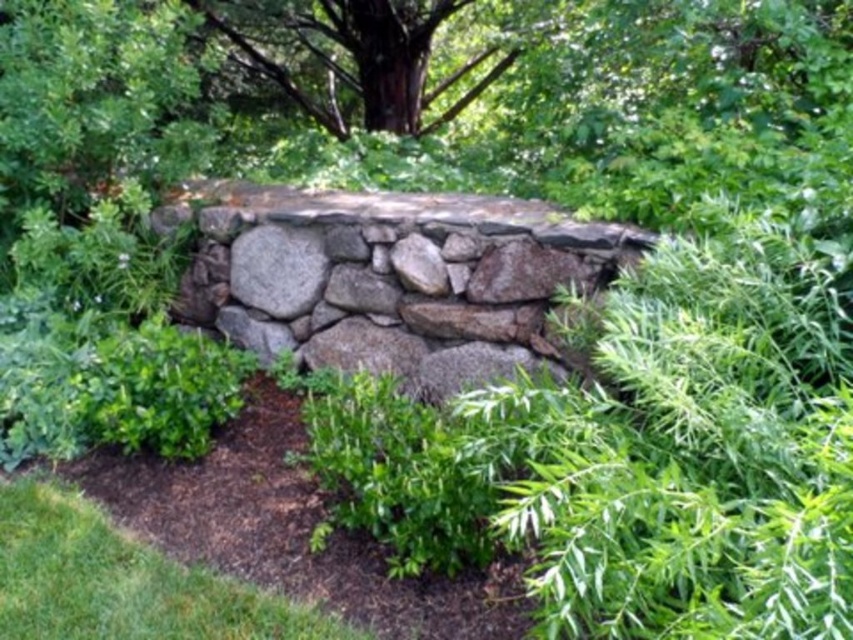
You are standing in the garden looking at the stone wall. There are two points marked on the wall at coordinates point (679,557) and point (532,256). Which point is closer to you?

Point (679,557) is in front of point (532,256), so it is closer to you.

You are a gardener planning to trim the green leafy bush at center and the natural gray stone wall at center. From the perspective of someone standing in front of the wall, which object is located to the right?

The green leafy bush at center is positioned on the right side of the natural gray stone wall at center, so from the perspective of someone standing in front of the wall, the green leafy bush at center is located to the right.

Consider the image. You are a gardener who needs to water the green leafy bush at center and the natural gray stone wall at center. Your watering can has a maximum reach of 36 inches. Can you water both objects without moving the watering can?

The distance between the green leafy bush at center and the natural gray stone wall at center is 35.95 inches, which is just under the watering can reach of 36 inches. Therefore, you can water both objects without moving the watering can.